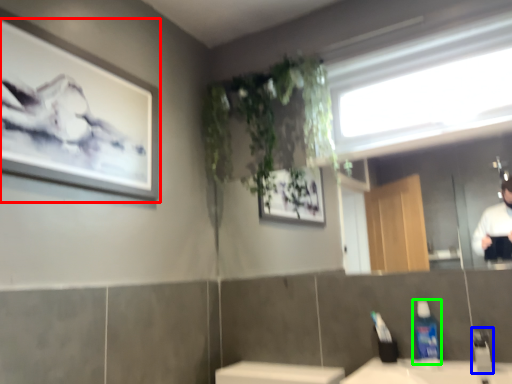
Question: Considering the real-world distances, which object is farthest from picture frame (highlighted by a red box)? faucet (highlighted by a blue box) or cleaning product (highlighted by a green box)?

Choices:
 (A) faucet
 (B) cleaning product

Answer: (A)